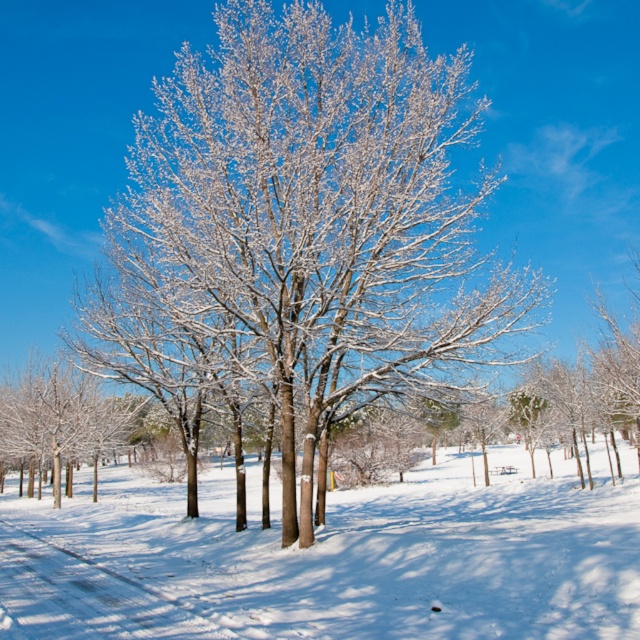
You are standing at the origin point in this winter scene. There are two points marked on the ground. The first is at point (406, 148) and the second is at point (252, 474). Which point is closer to you?

Point (406, 148) is in front of point (252, 474), so it is closer to you.